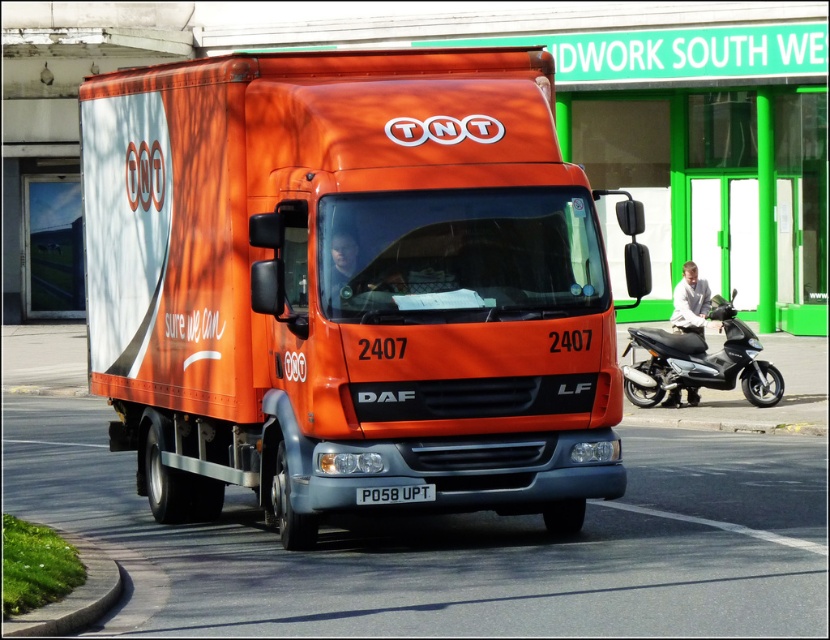
You are a pedestrian standing on the sidewalk next to the orange matte truck at center and the black matte scooter at right. Which object would block your view of the sky more if you were to stand directly in front of them?

The orange matte truck at center would block your view of the sky more because it is much taller than the black matte scooter at right.

You are a photographer taking a picture of the TNT delivery truck. You notice two points marked on your camera screen at coordinates point (462, 310) and point (396, 500). Which point is closer to the camera?

Point (396, 500) is closer to the camera because it is not as far away as point (462, 310).

You are standing on the side of the road and see the orange matte truck at center approaching you. If the truck is moving at 30 km per hour, how many seconds will it take for the truck to reach you?

The orange matte truck at center is 9.75 meters away from you. At a speed of 30 km per hour, which converts to approximately 8.33 meters per second, it will take about 1.17 seconds for the truck to reach you.